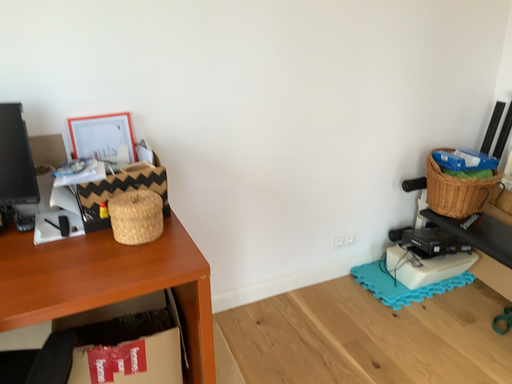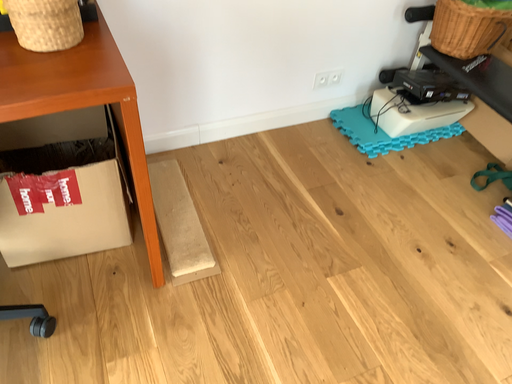
Question: How did the camera likely rotate when shooting the video?

Choices:
 (A) rotated downward
 (B) rotated upward

Answer: (A)